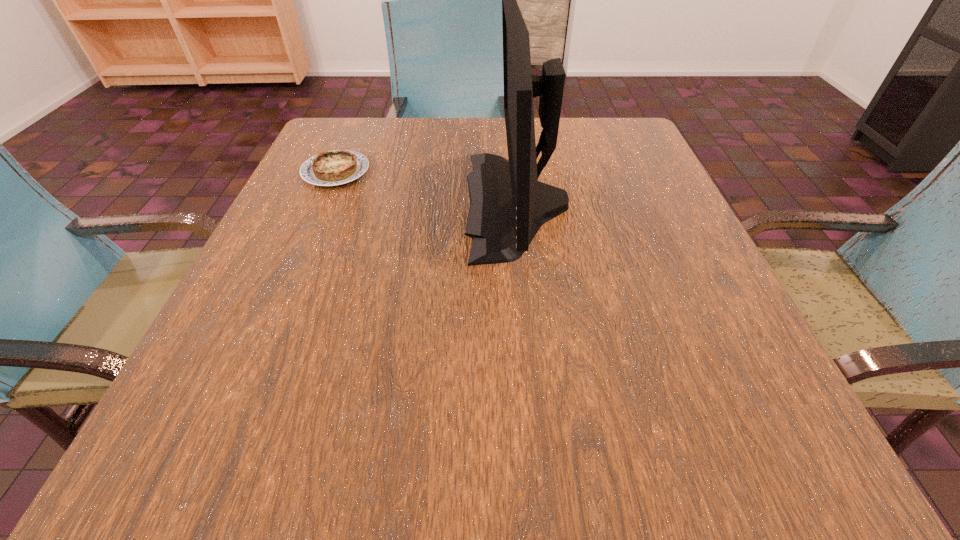
This screenshot has height=540, width=960. I want to click on object located at the left edge, so click(x=330, y=168).

Image resolution: width=960 pixels, height=540 pixels. I want to click on object situated at the far left corner, so click(x=330, y=168).

This screenshot has height=540, width=960. In order to click on vacant region at the near edge in this screenshot , I will do tap(488, 419).

Identify the location of free point at the left edge. This screenshot has height=540, width=960. (326, 218).

You are a GUI agent. You are given a task and a screenshot of the screen. Output one action in this format:
    pyautogui.click(x=<x>, y=<y>)
    Task: Click on the free space at the right edge of the desktop
    Image resolution: width=960 pixels, height=540 pixels.
    Given the screenshot: What is the action you would take?
    pyautogui.click(x=721, y=401)

In the image, there is a desktop. At what (x,y) coordinates should I click in order to perform the action: click on vacant region at the near left corner. Please return your answer as a coordinate pair (x, y). The width and height of the screenshot is (960, 540). Looking at the image, I should click on (277, 421).

Identify the location of vacant space at the far right corner of the desktop. The width and height of the screenshot is (960, 540). (596, 122).

Identify the location of free region at the near right corner of the desktop. The height and width of the screenshot is (540, 960). (792, 415).